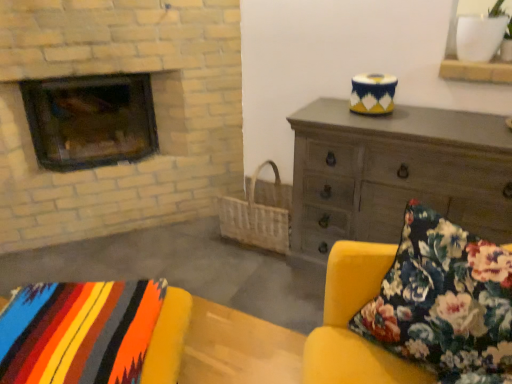
Question: From a real-world perspective, does floral fabric cushion at lower right stand above multicolored woven blanket at lower left?

Choices:
 (A) yes
 (B) no

Answer: (A)

Question: Does floral fabric cushion at lower right appear on the left side of multicolored woven blanket at lower left?

Choices:
 (A) yes
 (B) no

Answer: (B)

Question: Considering the relative sizes of floral fabric cushion at lower right and multicolored woven blanket at lower left in the image provided, is floral fabric cushion at lower right thinner than multicolored woven blanket at lower left?

Choices:
 (A) no
 (B) yes

Answer: (B)

Question: Does floral fabric cushion at lower right appear on the right side of multicolored woven blanket at lower left?

Choices:
 (A) yes
 (B) no

Answer: (A)

Question: Is floral fabric cushion at lower right positioned far away from multicolored woven blanket at lower left?

Choices:
 (A) no
 (B) yes

Answer: (A)

Question: Would you say multicolored woven blanket at lower left is inside or outside floral fabric cushion at lower right?

Choices:
 (A) outside
 (B) inside

Answer: (A)

Question: In the image, is multicolored woven blanket at lower left positioned in front of or behind floral fabric cushion at lower right?

Choices:
 (A) behind
 (B) front

Answer: (A)

Question: From the image's perspective, is multicolored woven blanket at lower left above or below floral fabric cushion at lower right?

Choices:
 (A) below
 (B) above

Answer: (A)

Question: Visually, is multicolored woven blanket at lower left positioned to the left or to the right of floral fabric cushion at lower right?

Choices:
 (A) right
 (B) left

Answer: (B)

Question: Is dark gray wooden chest of drawers at upper right in front of or behind floral fabric cushion at lower right in the image?

Choices:
 (A) behind
 (B) front

Answer: (A)

Question: Is point (309, 119) closer or farther from the camera than point (337, 367)?

Choices:
 (A) farther
 (B) closer

Answer: (A)

Question: Considering the positions of dark gray wooden chest of drawers at upper right and floral fabric cushion at lower right in the image, is dark gray wooden chest of drawers at upper right taller or shorter than floral fabric cushion at lower right?

Choices:
 (A) short
 (B) tall

Answer: (B)

Question: From the image's perspective, is dark gray wooden chest of drawers at upper right above or below floral fabric cushion at lower right?

Choices:
 (A) above
 (B) below

Answer: (A)

Question: Do you think dark brown wood burning stove at left is within floral fabric cushion at lower right, or outside of it?

Choices:
 (A) outside
 (B) inside

Answer: (A)

Question: Looking at the image, does dark brown wood burning stove at left seem bigger or smaller compared to floral fabric cushion at lower right?

Choices:
 (A) big
 (B) small

Answer: (A)